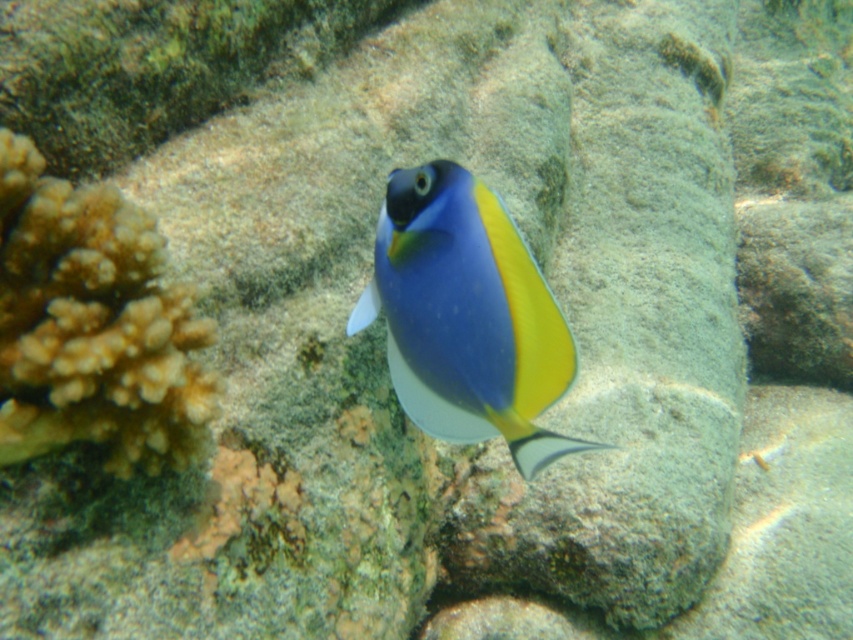
Question: Is the position of brown textured coral at left more distant than that of matte blue fish at center?

Choices:
 (A) yes
 (B) no

Answer: (A)

Question: Which object is farther from the camera taking this photo?

Choices:
 (A) matte blue fish at center
 (B) brown textured coral at left

Answer: (B)

Question: Which point is closer to the camera?

Choices:
 (A) matte blue fish at center
 (B) brown textured coral at left

Answer: (A)

Question: Which point appears closest to the camera in this image?

Choices:
 (A) (114, 420)
 (B) (538, 332)

Answer: (B)

Question: Is brown textured coral at left positioned before matte blue fish at center?

Choices:
 (A) no
 (B) yes

Answer: (A)

Question: Does brown textured coral at left have a lesser width compared to matte blue fish at center?

Choices:
 (A) no
 (B) yes

Answer: (B)